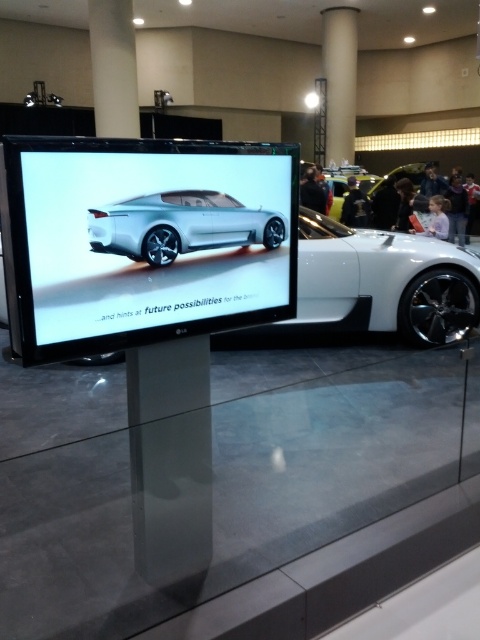
Who is taller, matte silver car at center or sleek silver car at center?

matte silver car at center is taller.

From the picture: Is matte silver car at center bigger than sleek silver car at center?

Correct, matte silver car at center is larger in size than sleek silver car at center.

Is point (173, 314) positioned after point (156, 250)?

Yes, point (173, 314) is farther from viewer.

The height and width of the screenshot is (640, 480). Identify the location of matte silver car at center. (144, 241).

Can you confirm if white matte/sleek sports car at center is wider than sleek silver car at center?

Indeed, white matte/sleek sports car at center has a greater width compared to sleek silver car at center.

Is point (447, 259) farther from camera compared to point (166, 205)?

Yes, point (447, 259) is farther from viewer.

The image size is (480, 640). In order to click on white matte/sleek sports car at center in this screenshot , I will do `click(381, 284)`.

Is matte silver car at center taller than white matte/sleek sports car at center?

No.

Who is taller, matte silver car at center or white matte/sleek sports car at center?

With more height is white matte/sleek sports car at center.

What do you see at coordinates (144, 241) in the screenshot? I see `matte silver car at center` at bounding box center [144, 241].

The height and width of the screenshot is (640, 480). In order to click on matte silver car at center in this screenshot , I will do `click(144, 241)`.